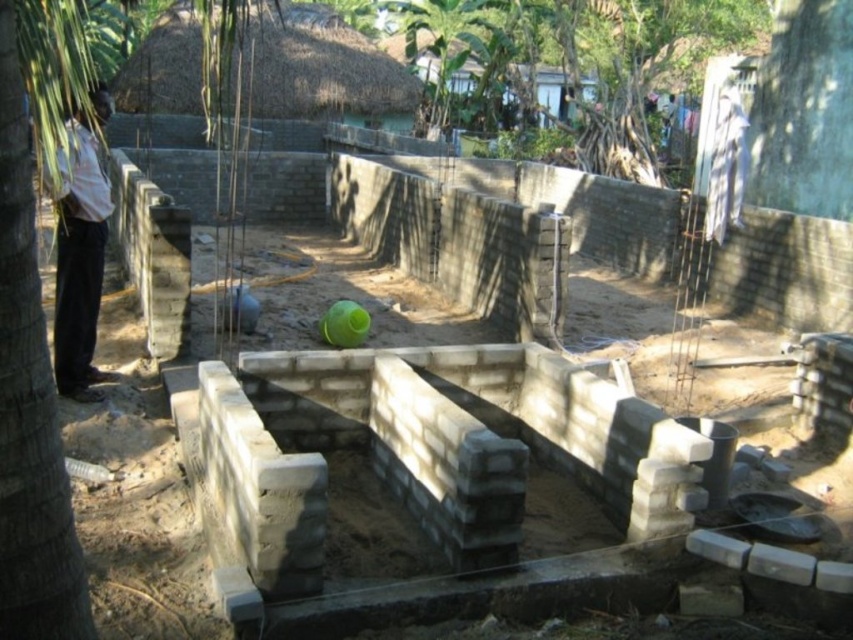
Question: Considering the relative positions of green leafy tree at left and white shirt at left in the image provided, where is green leafy tree at left located with respect to white shirt at left?

Choices:
 (A) above
 (B) below

Answer: (A)

Question: Among these objects, which one is farthest from the camera?

Choices:
 (A) white shirt at left
 (B) green leafy tree at left
 (C) gray concrete foundation at center

Answer: (A)

Question: Can you confirm if green leafy tree at left is positioned below white shirt at left?

Choices:
 (A) yes
 (B) no

Answer: (B)

Question: Which of the following is the farthest from the observer?

Choices:
 (A) (26, 246)
 (B) (106, 99)
 (C) (462, 538)

Answer: (B)

Question: Is green leafy tree at left positioned before white shirt at left?

Choices:
 (A) no
 (B) yes

Answer: (B)

Question: Which object is positioned farthest from the gray concrete foundation at center?

Choices:
 (A) white shirt at left
 (B) green leafy tree at left

Answer: (B)